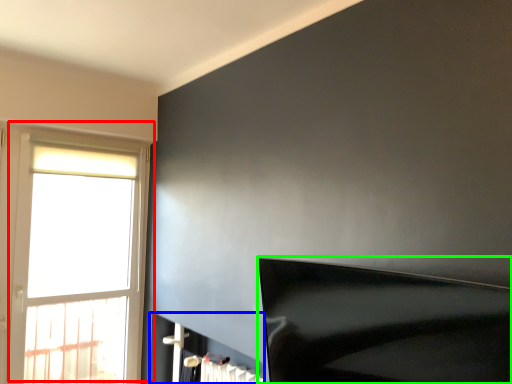
Question: Considering the real-world distances, which object is closest to window (highlighted by a red box)? fireplace (highlighted by a blue box) or furniture (highlighted by a green box).

Choices:
 (A) fireplace
 (B) furniture

Answer: (A)